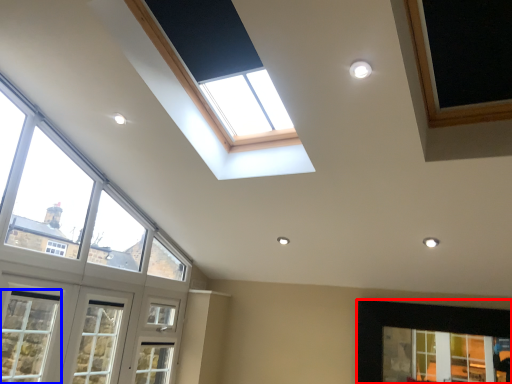
Question: Which point is further to the camera, window (highlighted by a red box) or window (highlighted by a blue box)?

Choices:
 (A) window
 (B) window

Answer: (A)